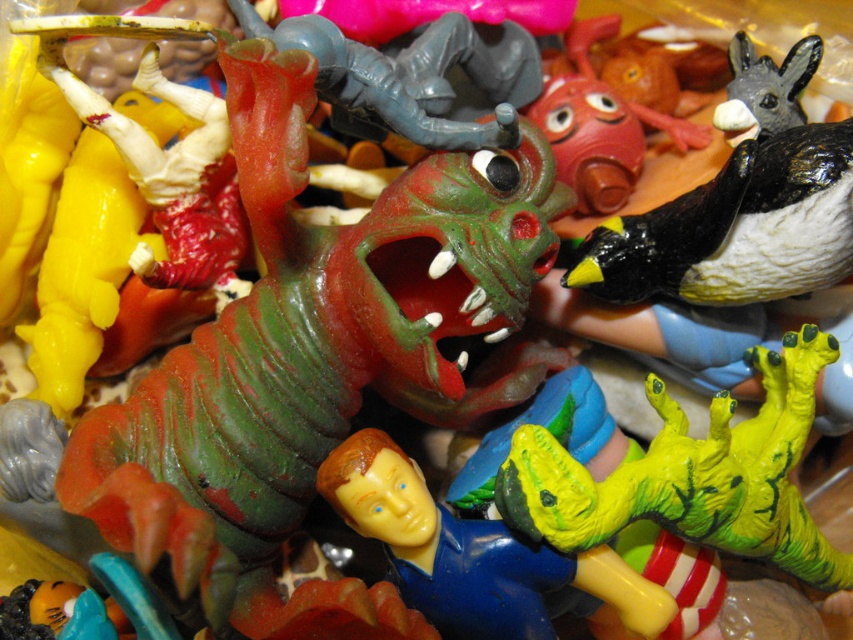
Question: Does shiny black bird at center have a smaller size compared to yellow matte figure at center?

Choices:
 (A) yes
 (B) no

Answer: (B)

Question: Which of these objects is positioned closest to the shiny black bird at center?

Choices:
 (A) yellow matte figure at center
 (B) black matte penguin at upper right

Answer: (A)

Question: Which of the following is the closest to the observer?

Choices:
 (A) black matte penguin at upper right
 (B) yellow matte figure at center

Answer: (B)

Question: Does black matte penguin at upper right appear under yellow matte figure at center?

Choices:
 (A) no
 (B) yes

Answer: (A)

Question: Which point is closer to the camera taking this photo?

Choices:
 (A) (619, 294)
 (B) (821, 352)

Answer: (B)

Question: Can you confirm if black matte penguin at upper right is positioned to the left of yellow matte figure at center?

Choices:
 (A) yes
 (B) no

Answer: (B)